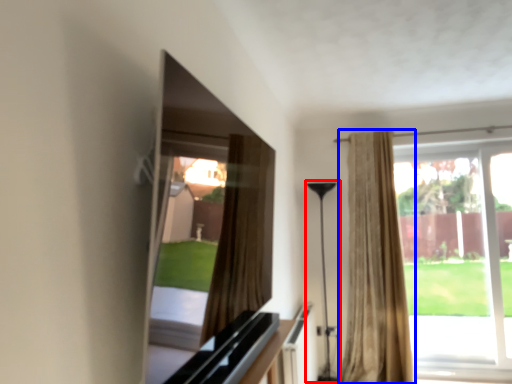
Question: Which object is further to the camera taking this photo, lamp (highlighted by a red box) or curtain (highlighted by a blue box)?

Choices:
 (A) lamp
 (B) curtain

Answer: (A)